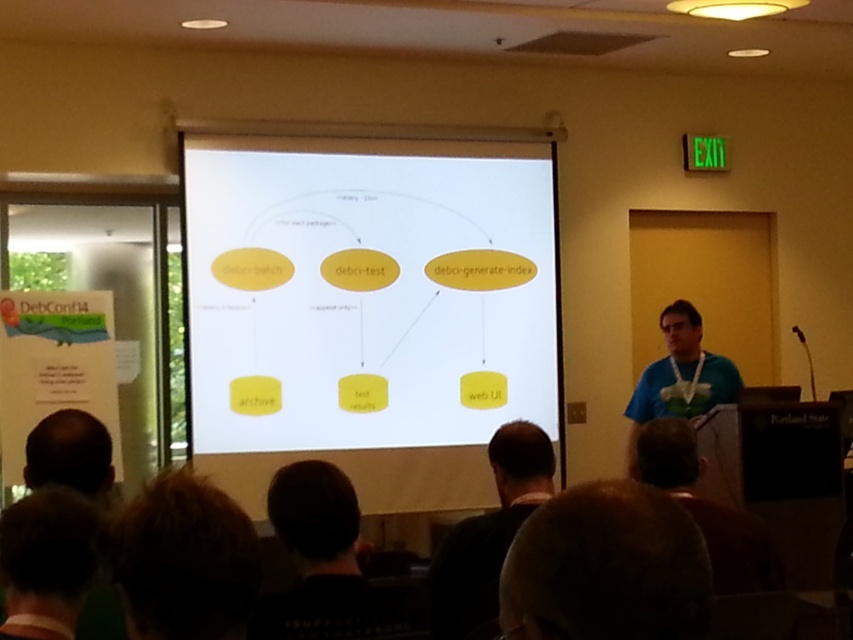
Question: Does blue t-shirt at right appear under bald head at lower left?

Choices:
 (A) no
 (B) yes

Answer: (B)

Question: Which point is closer to the camera?

Choices:
 (A) (505, 483)
 (B) (695, 403)
 (C) (665, 582)

Answer: (C)

Question: Is brown hair at lower center bigger than dark brown hair at lower center?

Choices:
 (A) yes
 (B) no

Answer: (B)

Question: Which object appears farthest from the camera in this image?

Choices:
 (A) dark brown hair at lower center
 (B) brown hair at lower center

Answer: (A)

Question: Estimate the real-world distances between objects in this image. Which object is farther from the dark brown hair at lower center?

Choices:
 (A) blue t-shirt at right
 (B) yellow matte diagram at center

Answer: (A)

Question: Is brown hair at lower center positioned before blue t-shirt at right?

Choices:
 (A) no
 (B) yes

Answer: (B)